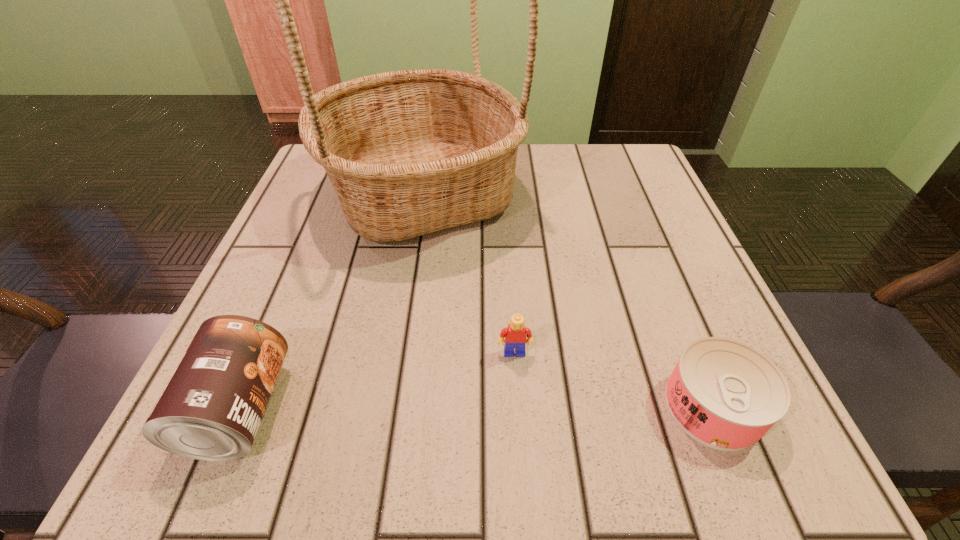
Find the location of a particular element. free point at the left edge is located at coordinates (328, 295).

Identify the location of free space at the right edge. The image size is (960, 540). (621, 219).

Where is `free space at the far right corner of the desktop`? free space at the far right corner of the desktop is located at coordinates (602, 164).

Where is `vacant space at the near right corner of the desktop`? Image resolution: width=960 pixels, height=540 pixels. vacant space at the near right corner of the desktop is located at coordinates (655, 409).

Where is `unoccupied area between the rightmost object and the third tallest object`? unoccupied area between the rightmost object and the third tallest object is located at coordinates (614, 380).

This screenshot has height=540, width=960. Find the location of `vacant area that lies between the third nearest object and the shorter can`. vacant area that lies between the third nearest object and the shorter can is located at coordinates (614, 380).

You are a GUI agent. You are given a task and a screenshot of the screen. Output one action in this format:
    pyautogui.click(x=<x>, y=<y>)
    Task: Click on the vacant space that's between the basket and the left can
    
    Given the screenshot: What is the action you would take?
    pyautogui.click(x=330, y=301)

The height and width of the screenshot is (540, 960). What are the coordinates of `free point between the rightmost object and the taller can` in the screenshot? It's located at (476, 408).

Where is `vacant area between the third shortest object and the second shortest object`? The height and width of the screenshot is (540, 960). vacant area between the third shortest object and the second shortest object is located at coordinates (377, 381).

You are a GUI agent. You are given a task and a screenshot of the screen. Output one action in this format:
    pyautogui.click(x=<x>, y=<y>)
    Task: Click on the vacant area that lies between the Lego and the farthest object
    
    Given the screenshot: What is the action you would take?
    pyautogui.click(x=468, y=273)